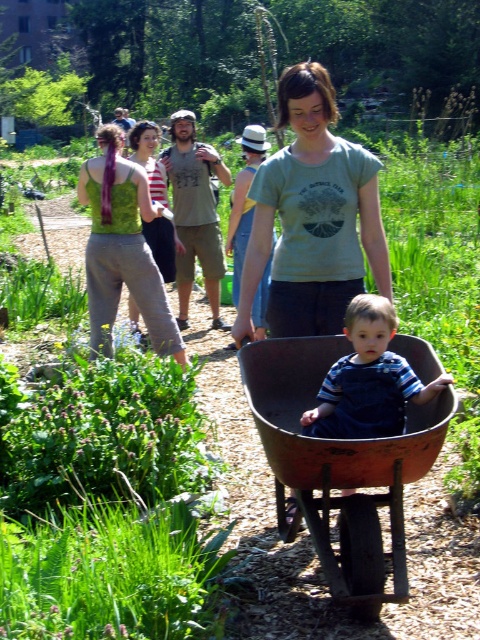
From the picture: You are standing at the origin point in the garden. There are two points marked in the image. The first point is at coordinates point [240,307] and the second point is at point [399,387]. If you want to walk towards the point that is behind the other, which coordinates should you head towards?

Point [240,307] is behind point [399,387]. Therefore, if you want to walk towards the point that is behind the other, you should head towards point [240,307].

You are standing at the origin point of the coordinate system in the image. You see the green t shirt at center represented by point (312, 218). What is the coordinate of the green t shirt at center?

The coordinate of the green t shirt at center is point (312, 218).